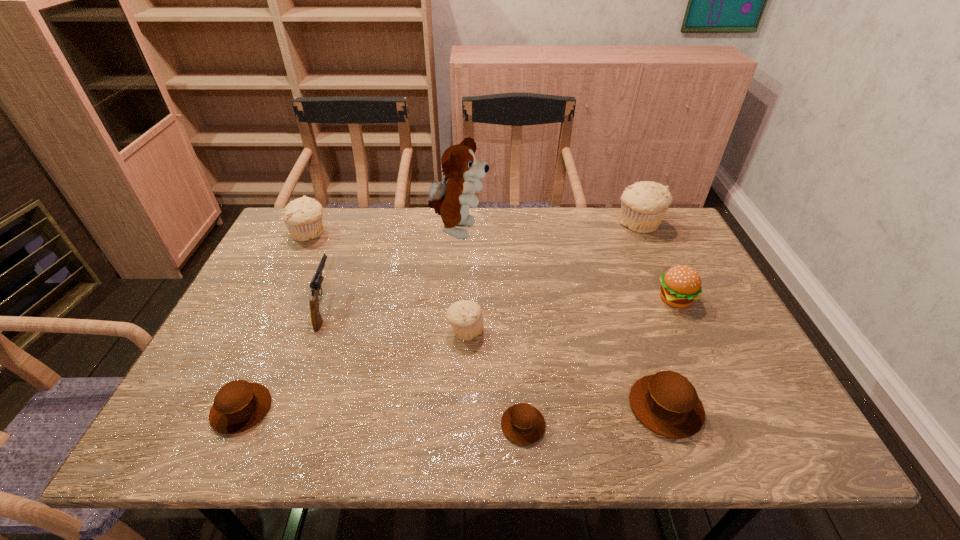
Where is `the fourth muffin from right to left`? the fourth muffin from right to left is located at coordinates (466, 317).

At what (x,y) coordinates should I click in order to perform the action: click on the biggest brown muffin. Please return your answer as a coordinate pair (x, y). Looking at the image, I should click on (666, 403).

Locate an element on the screen. This screenshot has width=960, height=540. the leftmost brown muffin is located at coordinates (239, 405).

Identify the location of the fifth tallest muffin. (239, 405).

What are the coordinates of `the shortest muffin` in the screenshot? It's located at (523, 424).

You are a GUI agent. You are given a task and a screenshot of the screen. Output one action in this format:
    pyautogui.click(x=<x>, y=<y>)
    Task: Click on the third muffin from right to left
    This screenshot has height=540, width=960.
    Given the screenshot: What is the action you would take?
    point(523,424)

At what (x,y) coordinates should I click in order to perform the action: click on free space located on the face of the tallest object. Please return your answer as a coordinate pair (x, y). Looking at the image, I should click on (571, 232).

You are a GUI agent. You are given a task and a screenshot of the screen. Output one action in this format:
    pyautogui.click(x=<x>, y=<y>)
    Task: Click on the vacant area situated on the left of the tallest muffin
    The image size is (960, 540).
    Given the screenshot: What is the action you would take?
    pyautogui.click(x=503, y=224)

Image resolution: width=960 pixels, height=540 pixels. Find the location of `free space located on the front of the second biggest beige muffin`. free space located on the front of the second biggest beige muffin is located at coordinates (299, 256).

Where is `vacant region located along the barrel of the gun`? This screenshot has height=540, width=960. vacant region located along the barrel of the gun is located at coordinates (359, 212).